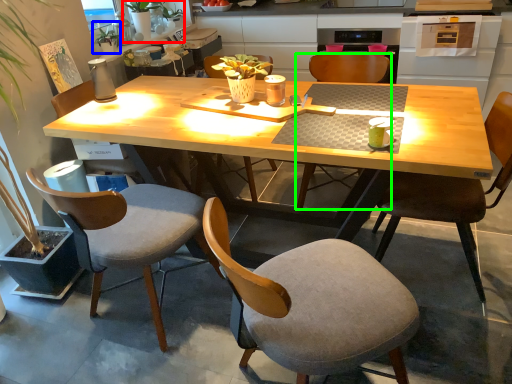
Question: Considering the real-world distances, which object is farthest from houseplant (highlighted by a red box)? houseplant (highlighted by a blue box) or chair (highlighted by a green box)?

Choices:
 (A) houseplant
 (B) chair

Answer: (B)